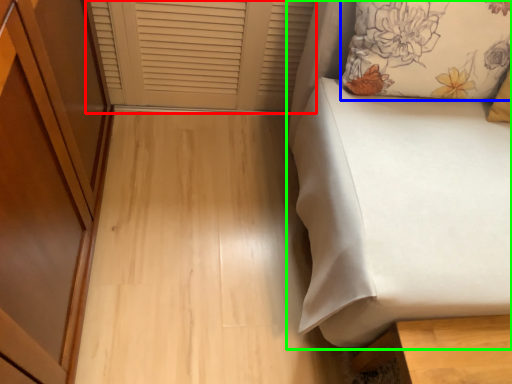
Question: Estimate the real-world distances between objects in this image. Which object is farther from window frame (highlighted by a red box), pillow (highlighted by a blue box) or furniture (highlighted by a green box)?

Choices:
 (A) pillow
 (B) furniture

Answer: (B)